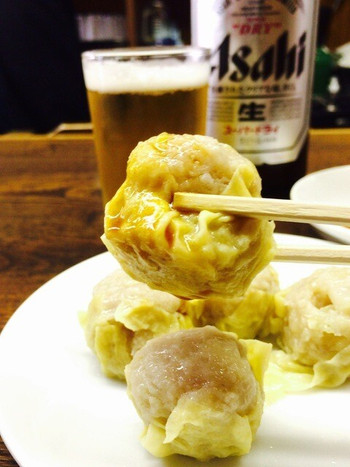
What are the coordinates of `chop sticks` in the screenshot? It's located at (286, 217), (298, 253).